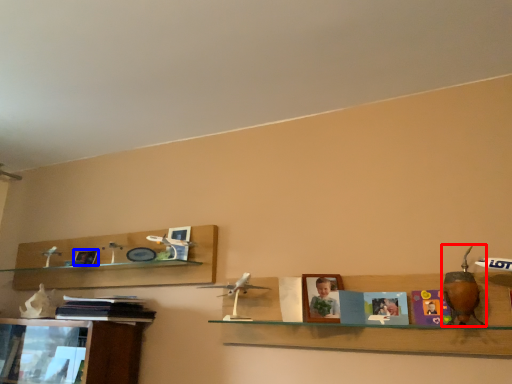
Question: Which object is closer to the camera taking this photo, toy (highlighted by a red box) or picture frame (highlighted by a blue box)?

Choices:
 (A) toy
 (B) picture frame

Answer: (A)